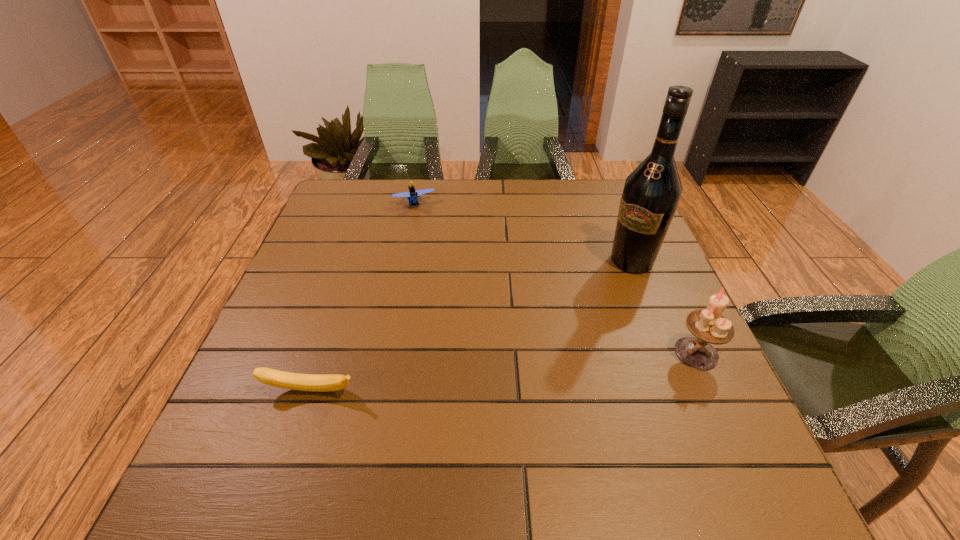
Image resolution: width=960 pixels, height=540 pixels. Identify the location of vacant spot on the desktop that is between the nearest object and the candle holder and is positioned on the label of the third nearest object. (546, 368).

The width and height of the screenshot is (960, 540). What are the coordinates of `free space on the desktop that is between the banana and the candle holder and is positioned on the front-facing side of the Lego` in the screenshot? It's located at (471, 375).